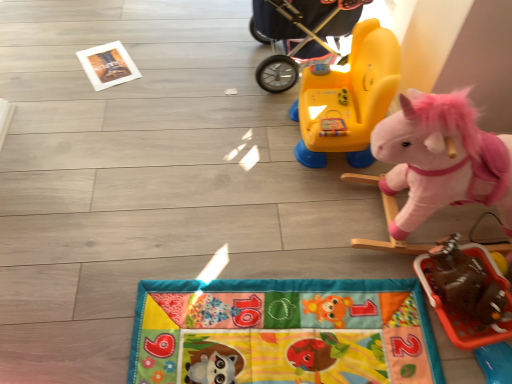
What are the coordinates of `free space in front of yellow plastic rocker at upper center, which appears as the 1th toy when viewed from the top` in the screenshot? It's located at (324, 204).